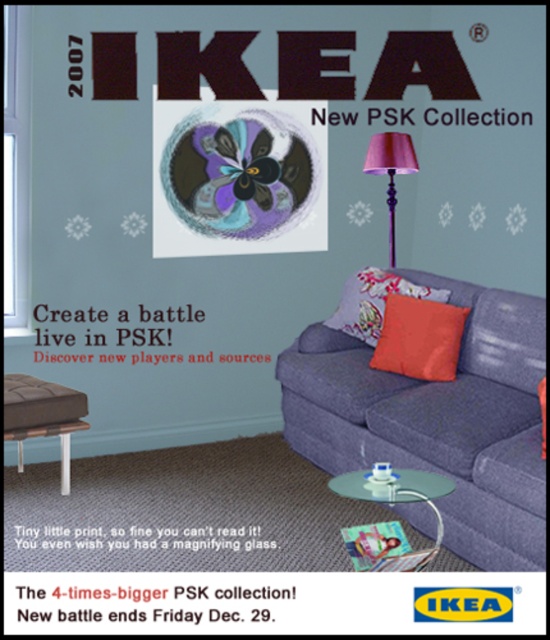
You are arranging a living room and want to place the purple fabric lampshade at upper right and the matte plastic flyer at lower center. According to the scene, which object is positioned to the right side of the other?

The purple fabric lampshade at upper right is to the right of the matte plastic flyer at lower center.

You are arranging flowers and flyers for an event. You have a metallic flower at center and a matte plastic flyer at lower center. According to the image, which object is located to the left of the other?

The metallic flower at center is positioned on the left side of matte plastic flyer at lower center.

You are standing in the living room and want to place a small decorative item exactly at the center of the metallic flower located at point (239, 177). Can you confirm if this point is within the boundaries of the sofa or the stool?

The point (239, 177) corresponds to the metallic flower at center, so it is not within the boundaries of the sofa or the stool.